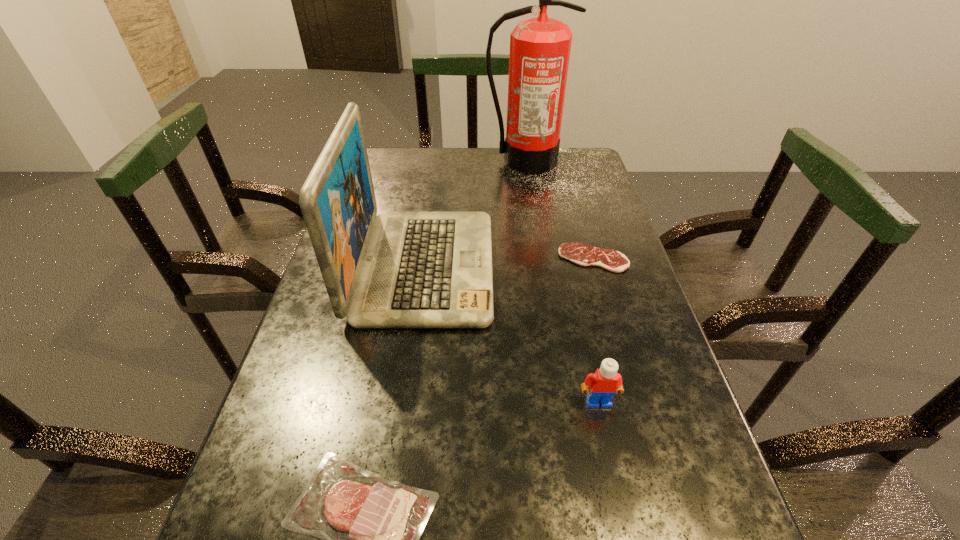
You are a GUI agent. You are given a task and a screenshot of the screen. Output one action in this format:
    pyautogui.click(x=<x>, y=<y>)
    Task: Click on the tallest object
    The width and height of the screenshot is (960, 540).
    Given the screenshot: What is the action you would take?
    pyautogui.click(x=540, y=47)

Locate an element on the screen. The height and width of the screenshot is (540, 960). the farthest object is located at coordinates (540, 47).

This screenshot has width=960, height=540. Find the location of `the fourth shortest object`. the fourth shortest object is located at coordinates (396, 269).

At what (x,y) coordinates should I click in order to perform the action: click on Lego. Please return your answer as a coordinate pair (x, y). This screenshot has height=540, width=960. Looking at the image, I should click on pos(601,386).

The width and height of the screenshot is (960, 540). Find the location of `the second nearest object`. the second nearest object is located at coordinates (601, 386).

Locate an element on the screen. the shortest object is located at coordinates (581, 254).

You are a GUI agent. You are given a task and a screenshot of the screen. Output one action in this format:
    pyautogui.click(x=<x>, y=<y>)
    Task: Click on the right steak
    
    Given the screenshot: What is the action you would take?
    pyautogui.click(x=581, y=254)

The image size is (960, 540). Find the location of `free space located on the front side of the tallest object`. free space located on the front side of the tallest object is located at coordinates (537, 238).

Identify the location of free spot located 0.080m on the screen of the laptop computer. The image size is (960, 540). (524, 267).

What are the coordinates of `free region located 0.110m on the face of the second nearest object` in the screenshot? It's located at (613, 469).